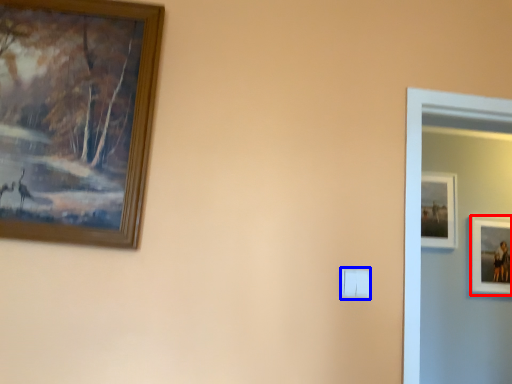
Question: Among these objects, which one is nearest to the camera, picture frame (highlighted by a red box) or light switch (highlighted by a blue box)?

Choices:
 (A) picture frame
 (B) light switch

Answer: (B)